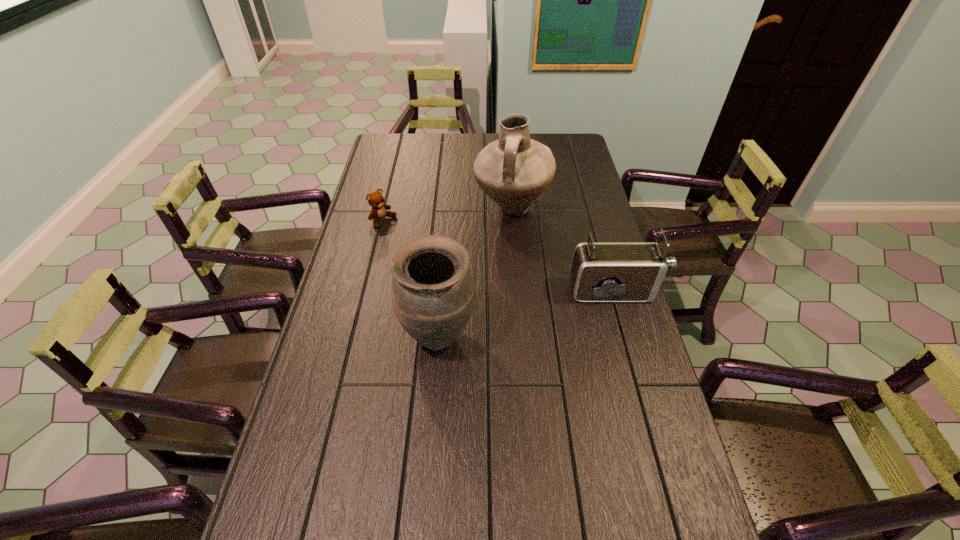
This screenshot has height=540, width=960. Find the location of `vacant space on the desktop that is between the urn and the camcorder and is positioned on the front-facing side of the shortest object`. vacant space on the desktop that is between the urn and the camcorder and is positioned on the front-facing side of the shortest object is located at coordinates (519, 316).

The width and height of the screenshot is (960, 540). What are the coordinates of `free spot on the desktop that is between the urn and the camcorder and is positioned on the handle side of the tallest object` in the screenshot? It's located at (535, 312).